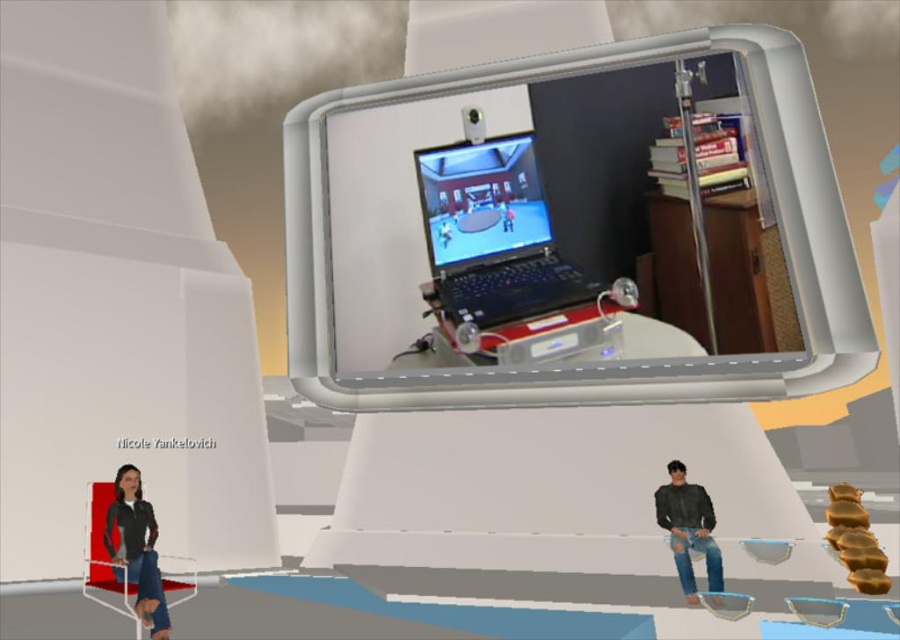
Does black plastic laptop at center appear under dark gray fabric jacket at lower left?

No, black plastic laptop at center is not below dark gray fabric jacket at lower left.

Does black plastic laptop at center have a smaller size compared to dark gray fabric jacket at lower left?

Correct, black plastic laptop at center occupies less space than dark gray fabric jacket at lower left.

Does point (526, 280) lie behind point (112, 528)?

No, it is in front of (112, 528).

At what (x,y) coordinates should I click in order to perform the action: click on black plastic laptop at center. Please return your answer as a coordinate pair (x, y). Looking at the image, I should click on (492, 234).

Which is below, black plastic laptop at center or ripped denim jeans at lower right?

ripped denim jeans at lower right is below.

Which of these two, black plastic laptop at center or ripped denim jeans at lower right, stands shorter?

black plastic laptop at center is shorter.

Locate an element on the screen. black plastic laptop at center is located at coordinates (492, 234).

Where is `dark gray fabric jacket at lower left`? The height and width of the screenshot is (640, 900). dark gray fabric jacket at lower left is located at coordinates (136, 548).

Identify the location of dark gray fabric jacket at lower left. The width and height of the screenshot is (900, 640). (136, 548).